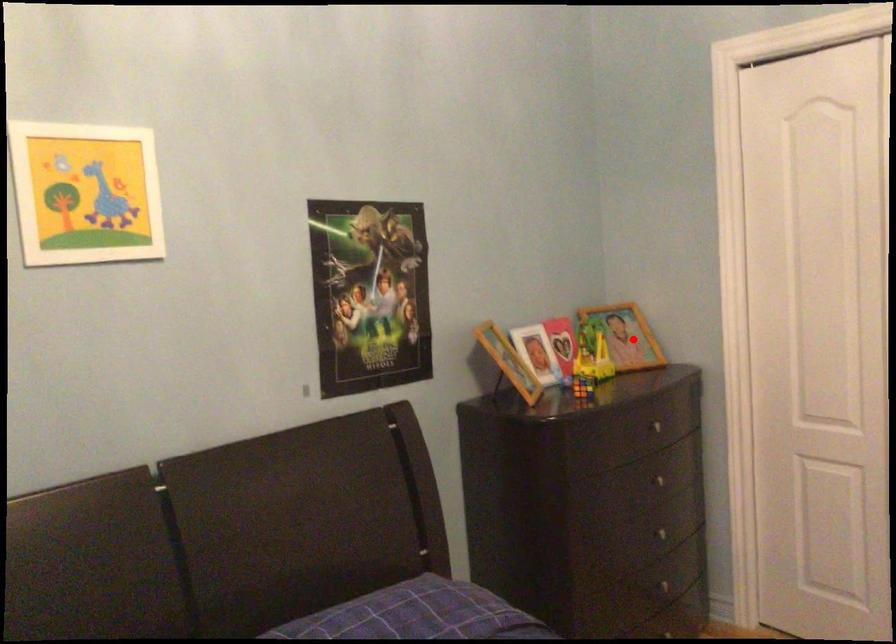
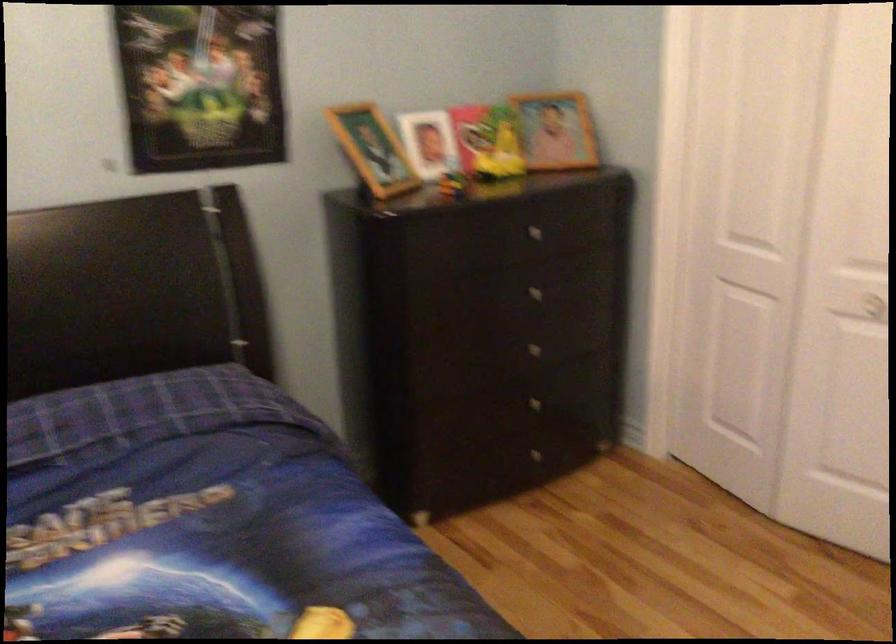
Question: A red point is marked in image1. In image2, is the corresponding 3D point closer to the camera or farther? Reply with the corresponding letter.

Choices:
 (A) The corresponding 3D point is closer.
 (B) The corresponding 3D point is farther.

Answer: (A)